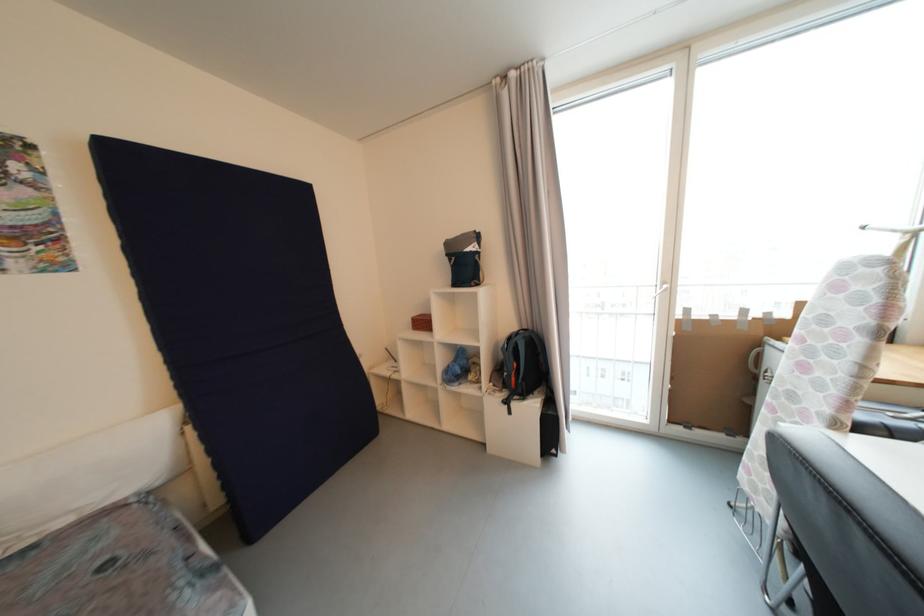
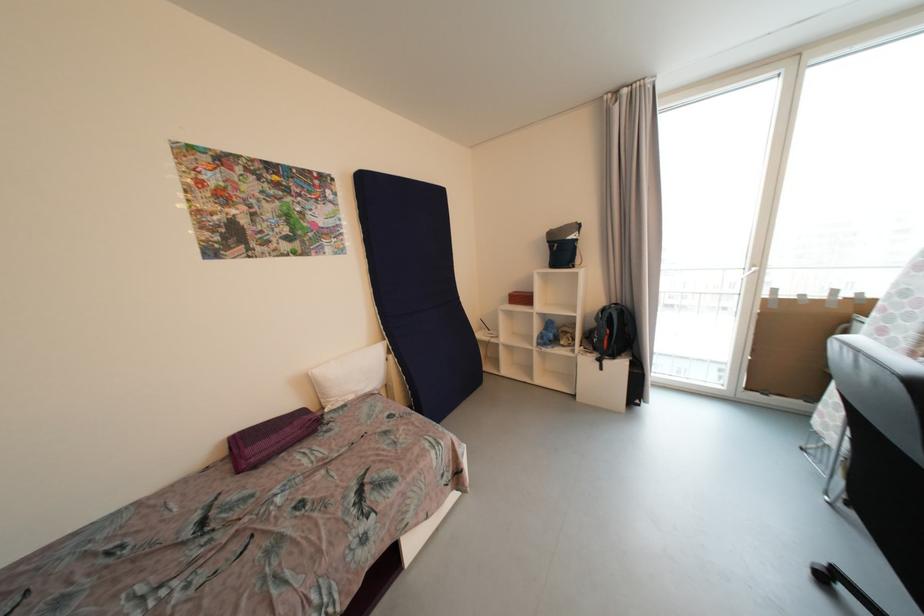
Find the pixel in the second image that matches (515,341) in the first image.

(608, 312)